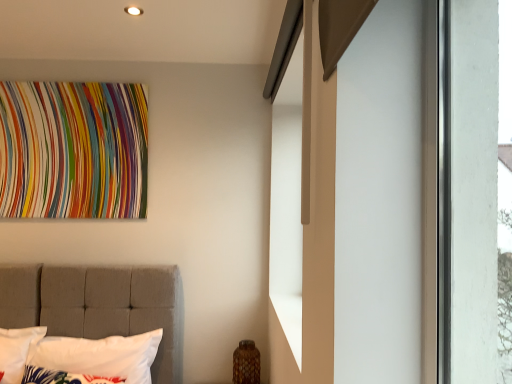
Question: Is white tufted pillow at left, which is the second pillow in front-to-back order, inside the boundaries of multicolored fabric tapestry at upper left, or outside?

Choices:
 (A) outside
 (B) inside

Answer: (A)

Question: Considering their positions, is white tufted pillow at left, which is the second pillow in front-to-back order, located in front of or behind multicolored fabric tapestry at upper left?

Choices:
 (A) front
 (B) behind

Answer: (A)

Question: Estimate the real-world distances between objects in this image. Which object is farther from the white tufted pillow at left, the first pillow positioned from the back?

Choices:
 (A) multicolored fabric tapestry at upper left
 (B) white fabric pillow at lower left, acting as the 2th pillow starting from the back

Answer: (A)

Question: Which of these objects is positioned closest to the white fabric pillow at lower left, acting as the 2th pillow starting from the back?

Choices:
 (A) white tufted pillow at left, which is the second pillow in front-to-back order
 (B) multicolored fabric tapestry at upper left

Answer: (A)